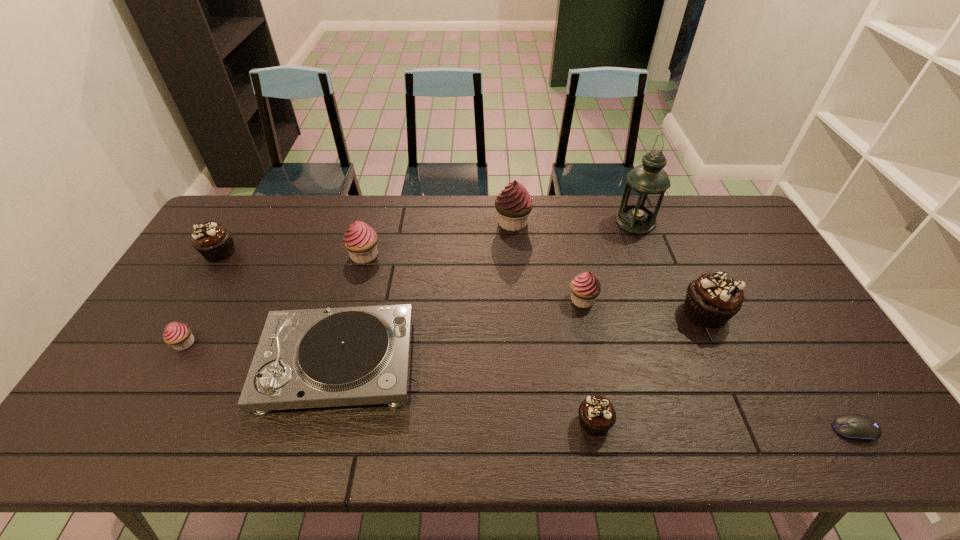
The height and width of the screenshot is (540, 960). I want to click on cupcake that stands as the closest to the tallest cupcake, so click(x=585, y=288).

Identify which cupcake is the sixth closest to the rightmost object. Please provide its 2D coordinates. Your answer should be formatted as a tuple, i.e. [(x, y)], where the tuple contains the x and y coordinates of a point satisfying the conditions above.

[(178, 335)]

Locate which pink cupcake is the second closest to the green oil lamp. Please provide its 2D coordinates. Your answer should be formatted as a tuple, i.e. [(x, y)], where the tuple contains the x and y coordinates of a point satisfying the conditions above.

[(514, 204)]

Find the location of a particular element. The image size is (960, 540). the second closest pink cupcake to the record player is located at coordinates (360, 240).

What are the coordinates of `brown cupcake that can be found as the second closest to the record player` in the screenshot? It's located at (596, 413).

This screenshot has height=540, width=960. I want to click on brown cupcake that stands as the closest to the farthest brown cupcake, so [x=596, y=413].

I want to click on vacant space that satisfies the following two spatial constraints: 1. on the back side of the second nearest cupcake; 2. on the right side of the second farthest pink cupcake, so click(x=234, y=255).

Locate an element on the screen. The width and height of the screenshot is (960, 540). vacant space that satisfies the following two spatial constraints: 1. on the front side of the second smallest pink cupcake; 2. on the right side of the rightmost cupcake is located at coordinates coord(585,313).